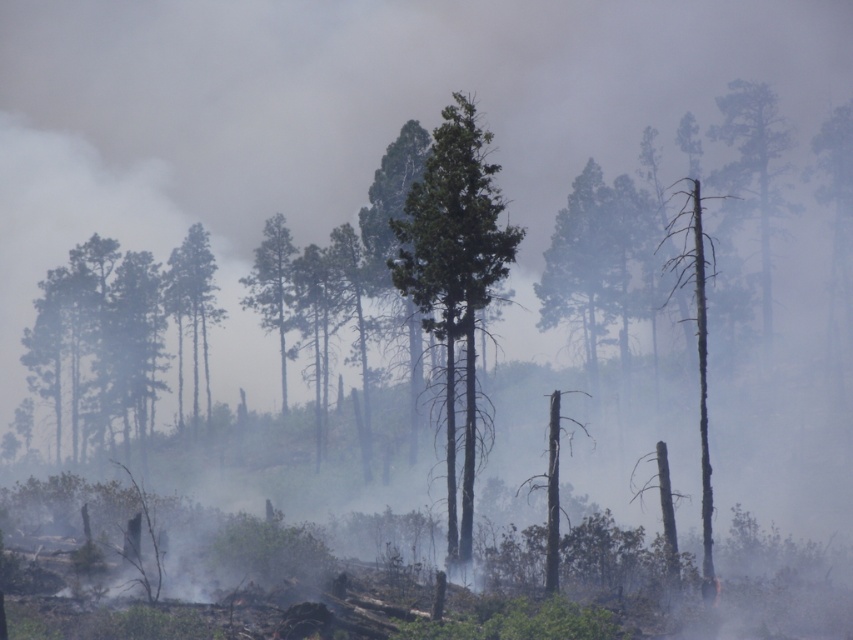
You are a firefighter assessing the wildfire damage. You notice the charred wood tree trunk at right and the green textured tree at center. Which tree has a wider trunk?

The charred wood tree trunk at right has a wider trunk than the green textured tree at center.

You are a firefighter assessing the wildfire damage. You notice a green rough bark tree at center and a charred wood tree trunk at right. Which tree is closer to the left side of the image?

The green rough bark tree at center is closer to the left side of the image because it is positioned to the left of the charred wood tree trunk at right.